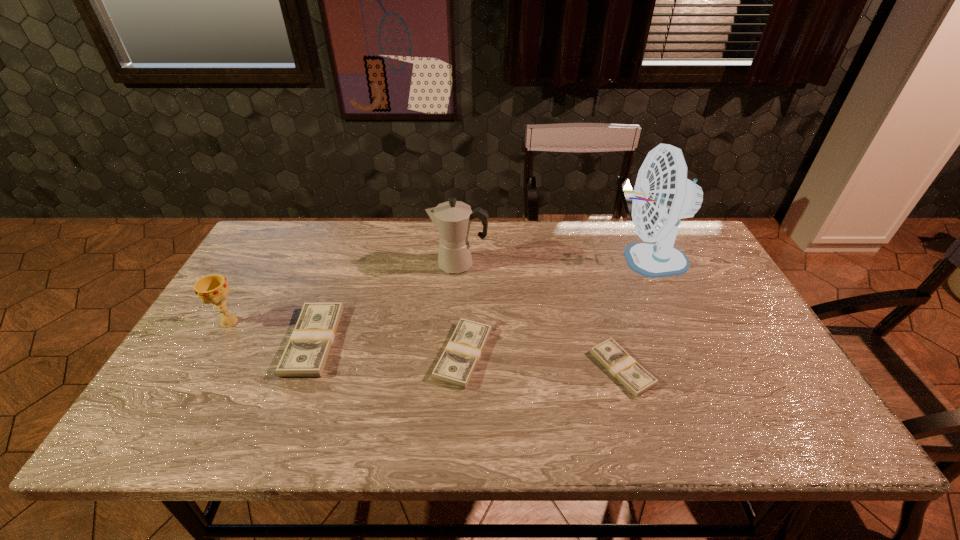
This screenshot has width=960, height=540. I want to click on object located in the left edge section of the desktop, so click(x=213, y=289).

Image resolution: width=960 pixels, height=540 pixels. I want to click on object at the right edge, so click(662, 195).

At what (x,y) coordinates should I click in order to perform the action: click on object located in the far right corner section of the desktop. Please return your answer as a coordinate pair (x, y). Looking at the image, I should click on (662, 195).

Locate an element on the screen. The width and height of the screenshot is (960, 540). free space at the far edge is located at coordinates (435, 256).

In the image, there is a desktop. In order to click on vacant space at the near edge in this screenshot , I will do pyautogui.click(x=378, y=383).

Find the location of a particular element. The height and width of the screenshot is (540, 960). vacant area at the left edge of the desktop is located at coordinates (233, 327).

What are the coordinates of `free region at the far left corner of the desktop` in the screenshot? It's located at (306, 244).

The height and width of the screenshot is (540, 960). Find the location of `free location at the near right corner`. free location at the near right corner is located at coordinates (773, 387).

Find the location of a particular element. free point between the rightmost dollar and the fan is located at coordinates (634, 314).

In order to click on free space between the second tallest object and the fan in this screenshot , I will do `click(552, 262)`.